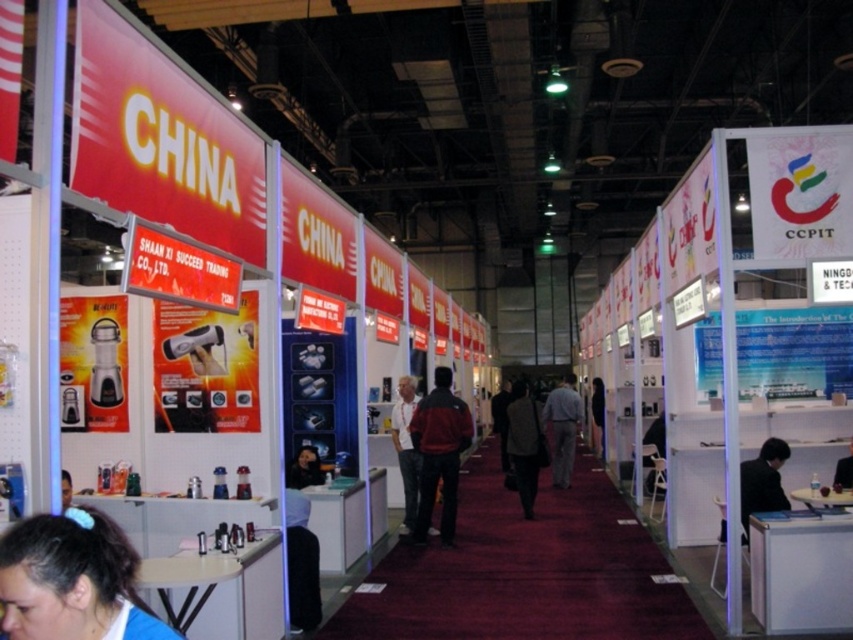
From the picture: You are standing at the entrance of the exhibition hall and see a dark gray fabric jacket at center located at point (524, 444). Is there any booth near that point that has red accents?

The dark gray fabric jacket at center is located at point (524, 444). The booths in the exhibition hall have red accents, so there is likely a booth near that point with red accents.

You are a photographer positioned at the entrance of the exhibition hall. You want to capture a photo of the dark brown hair at lower left and the dark gray fabric jacket at center in the same frame. Considering their sizes, which object should you zoom in on to ensure both are clearly visible?

Since the dark brown hair at lower left is narrower than the dark gray fabric jacket at center, you should zoom in on the dark gray fabric jacket at center to ensure both are clearly visible in the frame.